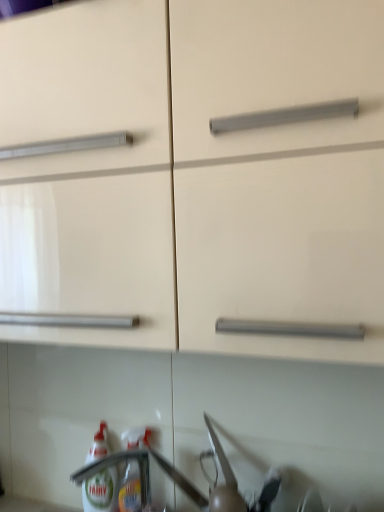
The height and width of the screenshot is (512, 384). In order to click on matte white cabinet at center in this screenshot , I will do `click(213, 164)`.

Identify the location of white glossy bottle at lower left, the first bottle positioned from the left. This screenshot has width=384, height=512. (100, 490).

At what (x,y) coordinates should I click in order to perform the action: click on matte white cabinet at center. Please return your answer as a coordinate pair (x, y). Looking at the image, I should click on (213, 164).

Is translucent plastic bottle at lower left, arranged as the second bottle when viewed from the left, aimed at white glossy bottle at lower left, acting as the second bottle starting from the right?

No, translucent plastic bottle at lower left, arranged as the second bottle when viewed from the left, does not turn towards white glossy bottle at lower left, acting as the second bottle starting from the right.

From their relative heights in the image, would you say translucent plastic bottle at lower left, arranged as the second bottle when viewed from the left, is taller or shorter than white glossy bottle at lower left, acting as the second bottle starting from the right?

Considering their sizes, translucent plastic bottle at lower left, arranged as the second bottle when viewed from the left, has less height than white glossy bottle at lower left, acting as the second bottle starting from the right.

Is translucent plastic bottle at lower left, arranged as the second bottle when viewed from the left, closer to the viewer compared to white glossy bottle at lower left, the first bottle positioned from the left?

Yes, translucent plastic bottle at lower left, arranged as the second bottle when viewed from the left, is in front of white glossy bottle at lower left, the first bottle positioned from the left.

From a real-world perspective, which object rests below the other?

In real-world perspective, white glossy bottle at lower left, the first bottle positioned from the left, is lower.

Considering their positions, is translucent plastic bottle at lower left, positioned as the first bottle in right-to-left order, located in front of or behind matte white cabinet at center?

Visually, translucent plastic bottle at lower left, positioned as the first bottle in right-to-left order, is located behind matte white cabinet at center.

Is point (133, 479) closer or farther from the camera than point (158, 242)?

Clearly, point (133, 479) is more distant from the camera than point (158, 242).

Which is more to the right, translucent plastic bottle at lower left, arranged as the second bottle when viewed from the left, or matte white cabinet at center?

Positioned to the right is matte white cabinet at center.

From a real-world perspective, is translucent plastic bottle at lower left, arranged as the second bottle when viewed from the left, physically below matte white cabinet at center?

Indeed, from a real-world perspective, translucent plastic bottle at lower left, arranged as the second bottle when viewed from the left, is positioned beneath matte white cabinet at center.

Is white glossy bottle at lower left, the first bottle positioned from the left, bigger or smaller than translucent plastic bottle at lower left, positioned as the first bottle in right-to-left order?

Considering their sizes, white glossy bottle at lower left, the first bottle positioned from the left, takes up more space than translucent plastic bottle at lower left, positioned as the first bottle in right-to-left order.

Consider the image. Does white glossy bottle at lower left, acting as the second bottle starting from the right, have a lesser width compared to translucent plastic bottle at lower left, arranged as the second bottle when viewed from the left?

Incorrect, the width of white glossy bottle at lower left, acting as the second bottle starting from the right, is not less than that of translucent plastic bottle at lower left, arranged as the second bottle when viewed from the left.

Locate an element on the screen. bottle that appears below the translucent plastic bottle at lower left, positioned as the first bottle in right-to-left order (from a real-world perspective) is located at coordinates (100, 490).

Is point (297, 182) positioned after point (123, 489)?

No, it is not.

From the picture: Is matte white cabinet at center positioned with its back to translucent plastic bottle at lower left, arranged as the second bottle when viewed from the left?

That's not correct — matte white cabinet at center is not looking away from translucent plastic bottle at lower left, arranged as the second bottle when viewed from the left.

Based on the photo, considering their positions, is matte white cabinet at center located in front of or behind translucent plastic bottle at lower left, arranged as the second bottle when viewed from the left?

Visually, matte white cabinet at center is located in front of translucent plastic bottle at lower left, arranged as the second bottle when viewed from the left.

Between matte white cabinet at center and translucent plastic bottle at lower left, positioned as the first bottle in right-to-left order, which one appears on the right side from the viewer's perspective?

Positioned to the right is matte white cabinet at center.

Consider the image. Can you confirm if white glossy bottle at lower left, the first bottle positioned from the left, is shorter than matte white cabinet at center?

Indeed, white glossy bottle at lower left, the first bottle positioned from the left, has a lesser height compared to matte white cabinet at center.

Find the location of `bottle that is the 2nd object located below the matte white cabinet at center (from the image's perspective)`. bottle that is the 2nd object located below the matte white cabinet at center (from the image's perspective) is located at coordinates (100, 490).

From the image's perspective, would you say white glossy bottle at lower left, the first bottle positioned from the left, is shown under matte white cabinet at center?

Correct, white glossy bottle at lower left, the first bottle positioned from the left, appears lower than matte white cabinet at center in the image.

Can you confirm if white glossy bottle at lower left, acting as the second bottle starting from the right, is bigger than matte white cabinet at center?

No, white glossy bottle at lower left, acting as the second bottle starting from the right, is not bigger than matte white cabinet at center.

Is white glossy bottle at lower left, acting as the second bottle starting from the right, located within matte white cabinet at center?

No, matte white cabinet at center does not contain white glossy bottle at lower left, acting as the second bottle starting from the right.

Is matte white cabinet at center turned away from white glossy bottle at lower left, the first bottle positioned from the left?

matte white cabinet at center is not turned away from white glossy bottle at lower left, the first bottle positioned from the left.

In the scene shown: Between matte white cabinet at center and white glossy bottle at lower left, the first bottle positioned from the left, which one has more height?

Standing taller between the two is matte white cabinet at center.

Between matte white cabinet at center and white glossy bottle at lower left, the first bottle positioned from the left, which one has smaller width?

Thinner between the two is white glossy bottle at lower left, the first bottle positioned from the left.

I want to click on bottle in front of the white glossy bottle at lower left, acting as the second bottle starting from the right, so click(131, 489).

From the image's perspective, which bottle is the 1st one below the matte white cabinet at center? Please provide its 2D coordinates.

[(131, 489)]

Estimate the real-world distances between objects in this image. Which object is further from white glossy bottle at lower left, acting as the second bottle starting from the right, translucent plastic bottle at lower left, positioned as the first bottle in right-to-left order, or matte white cabinet at center?

Among the two, matte white cabinet at center is located further to white glossy bottle at lower left, acting as the second bottle starting from the right.

Considering their positions, is white glossy bottle at lower left, acting as the second bottle starting from the right, positioned further to translucent plastic bottle at lower left, arranged as the second bottle when viewed from the left, than matte white cabinet at center?

matte white cabinet at center is positioned further to the anchor translucent plastic bottle at lower left, arranged as the second bottle when viewed from the left.

From the image, which object appears to be farther from matte white cabinet at center, white glossy bottle at lower left, acting as the second bottle starting from the right, or translucent plastic bottle at lower left, arranged as the second bottle when viewed from the left?

white glossy bottle at lower left, acting as the second bottle starting from the right, is positioned further to the anchor matte white cabinet at center.

Based on the photo, which object lies further to the anchor point white glossy bottle at lower left, acting as the second bottle starting from the right, matte white cabinet at center or translucent plastic bottle at lower left, positioned as the first bottle in right-to-left order?

matte white cabinet at center is further to white glossy bottle at lower left, acting as the second bottle starting from the right.

Based on their spatial positions, is matte white cabinet at center or white glossy bottle at lower left, the first bottle positioned from the left, closer to translucent plastic bottle at lower left, positioned as the first bottle in right-to-left order?

The object closer to translucent plastic bottle at lower left, positioned as the first bottle in right-to-left order, is white glossy bottle at lower left, the first bottle positioned from the left.

Which object lies nearer to the anchor point matte white cabinet at center, translucent plastic bottle at lower left, arranged as the second bottle when viewed from the left, or white glossy bottle at lower left, the first bottle positioned from the left?

The object closer to matte white cabinet at center is translucent plastic bottle at lower left, arranged as the second bottle when viewed from the left.

I want to click on bottle that lies between matte white cabinet at center and white glossy bottle at lower left, acting as the second bottle starting from the right, from top to bottom, so click(x=131, y=489).